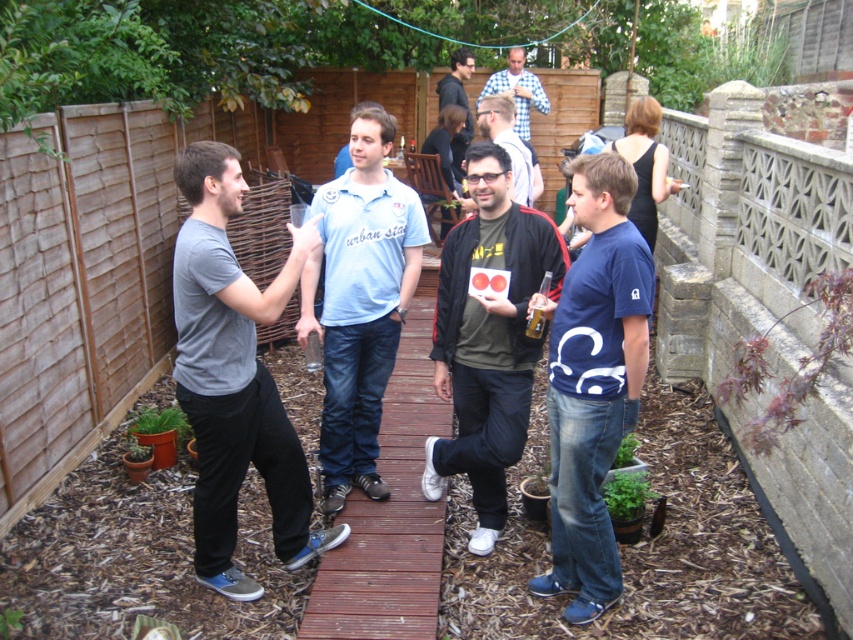
In the scene shown: You are planning to set up a long table for a group dinner in the backyard. The table requires a space that is wider than the brown wooden fence at left. Can the wooden deck at center accommodate this table?

The brown wooden fence at left has a lesser width compared to wooden deck at center, so the wooden deck at center is wider. Therefore, the wooden deck at center can accommodate the table since it is wider than the brown wooden fence at left.

What is the 2D coordinate of the wooden deck at center in the image?

The wooden deck at center is located at the 2D coordinate point of (392,509).